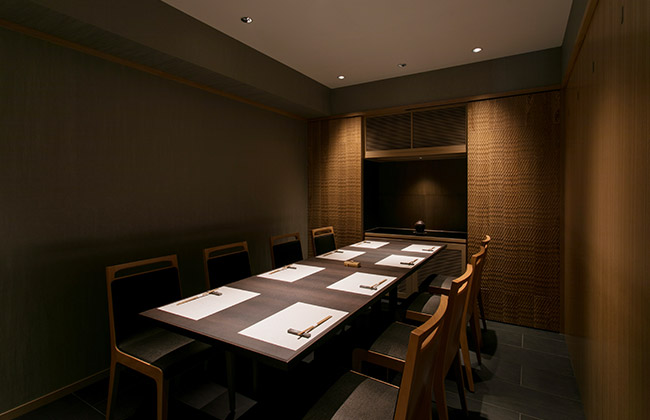
Find the location of a particular element. The image size is (650, 420). vented area - possible air conditioning is located at coordinates (385, 136).